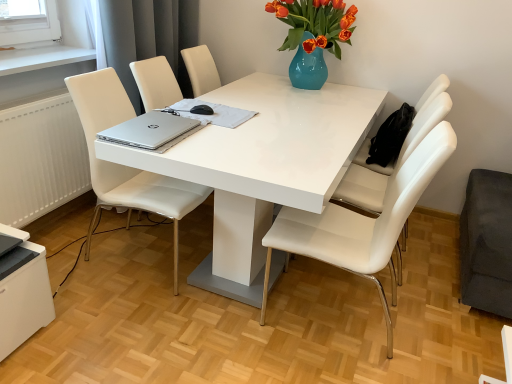
Locate an element on the screen. The image size is (512, 384). free space between white glossy desktop at lower left and white leather chair at center, which is the 1th chair from left to right is located at coordinates (90, 300).